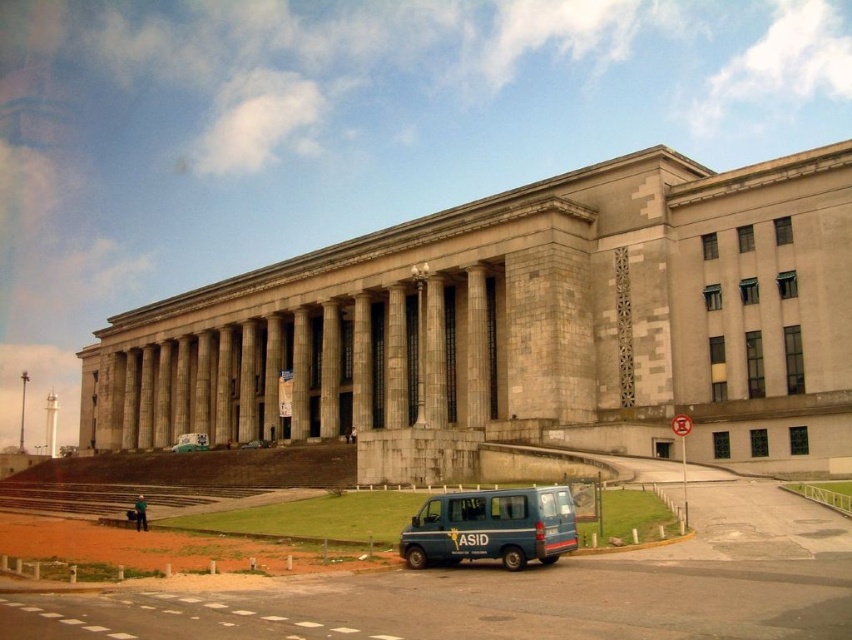
You are a pedestrian standing at the base of the staircase in front of the grand neoclassical building. You notice two vehicles nearby. Which one is positioned more to the right side from your viewpoint? The vehicles are the blue metallic van at lower center and the metallic blue van at center.

The blue metallic van at lower center is positioned more to the right side compared to the metallic blue van at center.

You are a delivery driver with a 50 meter long truck. You need to park your truck between the blue metallic van at lower center and the metallic blue van at center. Is there enough space between them to park your truck?

The blue metallic van at lower center and metallic blue van at center are 47.38 meters apart. Since your truck is 50 meters long, there is not enough space between them to park your truck.

You are standing at the base of the staircase in front of the grand neoclassical building. You see a blue metallic van at lower center and a metallic blue van at center. Which van is closer to you?

The blue metallic van at lower center is closer to the viewer than the metallic blue van at center, so the blue metallic van at lower center is closer to you.